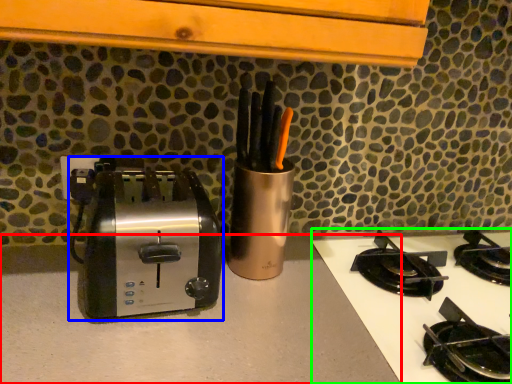
Question: Which object is positioned farthest from counter top (highlighted by a red box)? Select from toaster (highlighted by a blue box) and gas stove (highlighted by a green box).

Choices:
 (A) toaster
 (B) gas stove

Answer: (B)